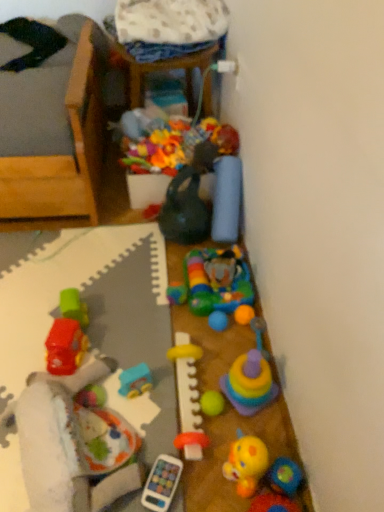
The width and height of the screenshot is (384, 512). I want to click on free space on the front side of blue plastic toy car at center, positioned as the tenth toy in right-to-left order, so click(x=146, y=429).